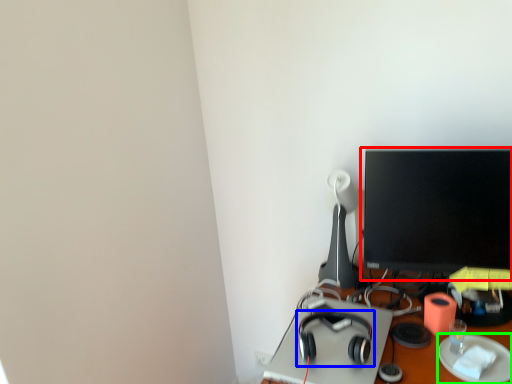
Question: Which is nearer to the computer monitor (highlighted by a red box)? headphones (highlighted by a blue box) or paper plate (highlighted by a green box).

Choices:
 (A) headphones
 (B) paper plate

Answer: (B)